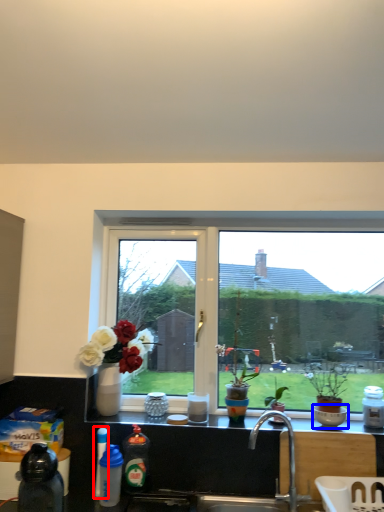
Question: Which point is closer to the camera, bottle (highlighted by a red box) or bowl (highlighted by a blue box)?

Choices:
 (A) bottle
 (B) bowl

Answer: (A)